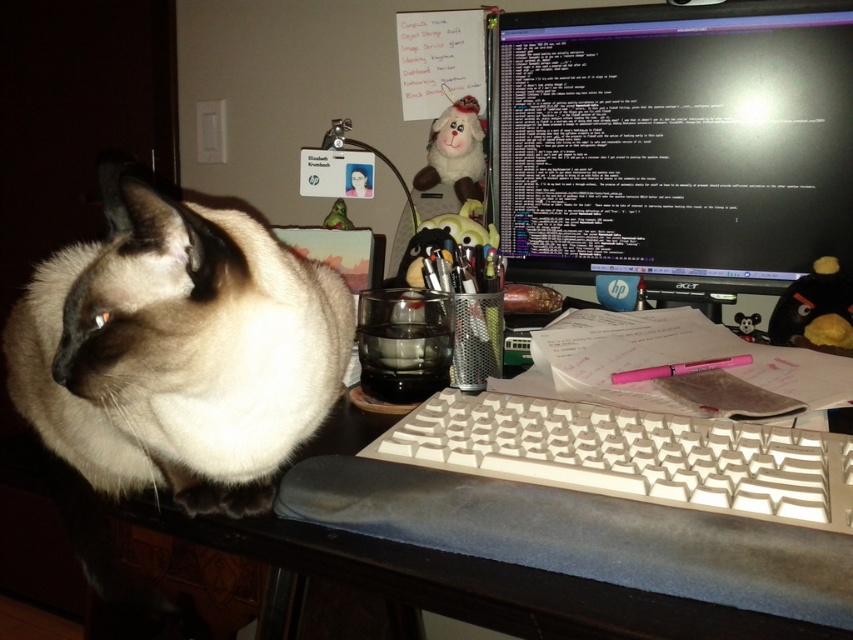
Question: Which object is farther from the camera taking this photo?

Choices:
 (A) pink plastic pen at lower right
 (B) white plastic keyboard at center

Answer: (A)

Question: Is black matte table at left above pink plastic pen at lower right?

Choices:
 (A) no
 (B) yes

Answer: (A)

Question: Observing the image, what is the correct spatial positioning of black glossy monitor at upper right in reference to white plastic keyboard at center?

Choices:
 (A) below
 (B) above

Answer: (B)

Question: Is black glossy monitor at upper right to the left of white plastic keyboard at center from the viewer's perspective?

Choices:
 (A) yes
 (B) no

Answer: (B)

Question: Which of the following is the farthest from the observer?

Choices:
 (A) pink plastic pen at lower right
 (B) smokey white fur cat at left
 (C) white plastic keyboard at center

Answer: (A)

Question: Which of these objects is positioned closest to the smokey white fur cat at left?

Choices:
 (A) black matte table at left
 (B) pink plastic pen at lower right
 (C) black glossy monitor at upper right

Answer: (A)